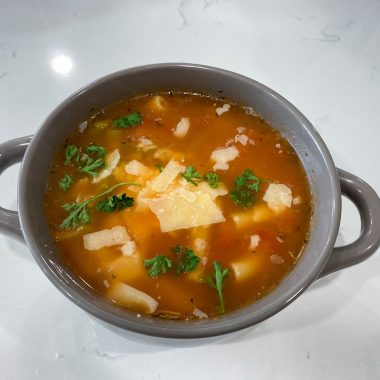
Identify the location of pot. (49, 141).